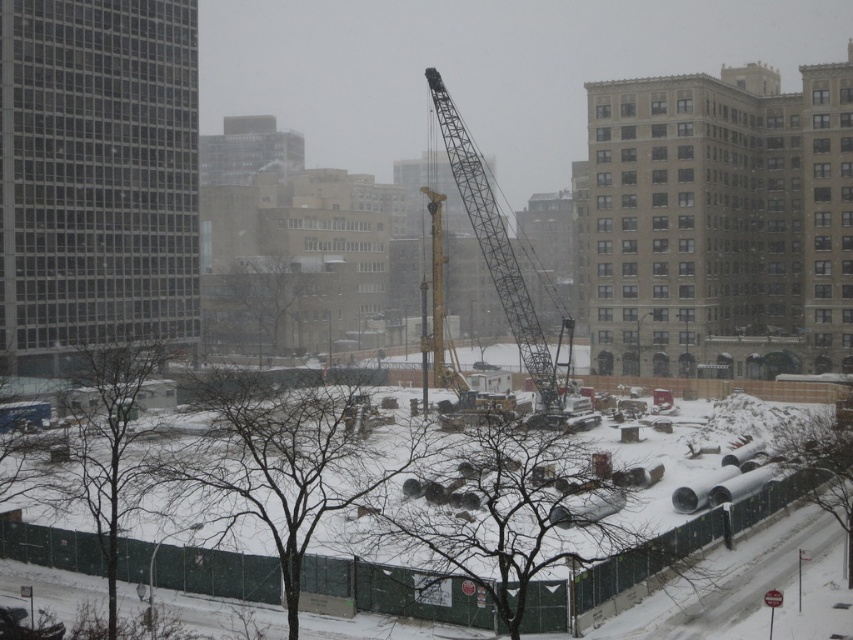
Question: In this image, where is metallic gray crane at center located relative to yellow metallic crane at center?

Choices:
 (A) above
 (B) below

Answer: (B)

Question: Which point is farther from the camera taking this photo?

Choices:
 (A) (440, 349)
 (B) (491, 236)
 (C) (451, 604)

Answer: (A)

Question: Does snowy concrete pipes at center have a larger size compared to yellow metallic crane at center?

Choices:
 (A) yes
 (B) no

Answer: (A)

Question: Can you confirm if metallic gray crane at center is positioned to the right of yellow metallic crane at center?

Choices:
 (A) no
 (B) yes

Answer: (B)

Question: Which of the following is the closest to the observer?

Choices:
 (A) (512, 324)
 (B) (434, 385)

Answer: (A)

Question: Which point is closer to the camera?

Choices:
 (A) (733, 513)
 (B) (442, 276)
 (C) (489, 211)

Answer: (A)